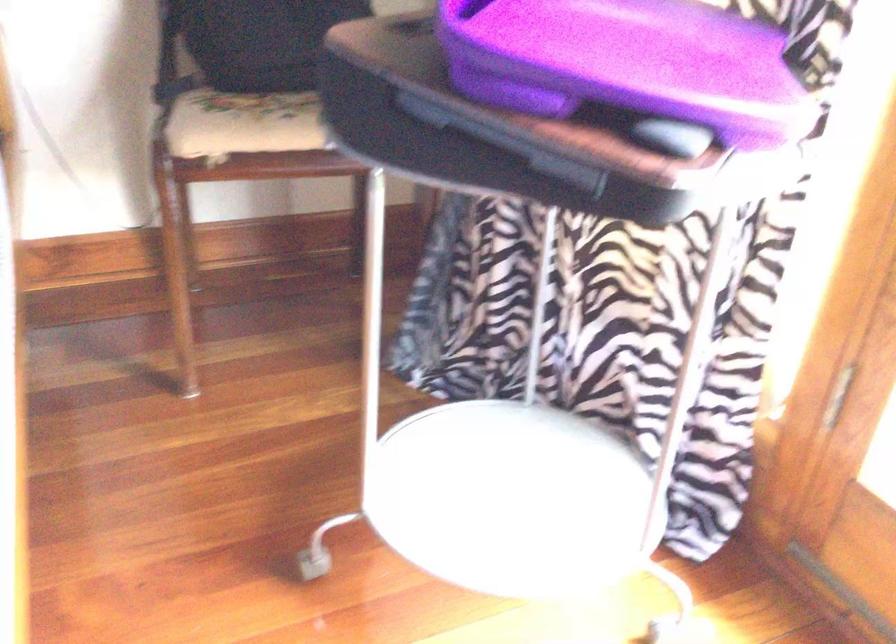
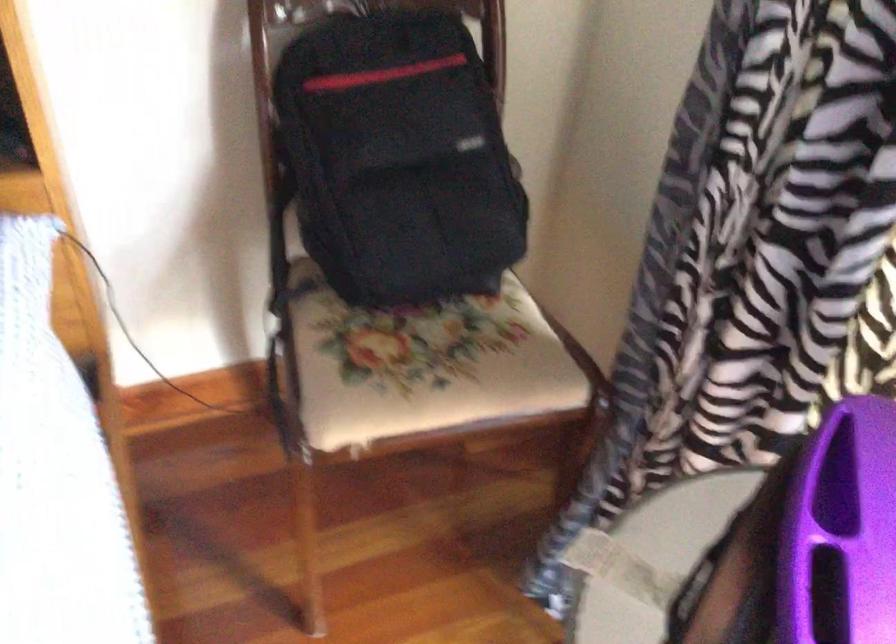
In a continuous first-person perspective shot, in which direction is the camera moving?

The movement direction of the cameraman is left, forward.